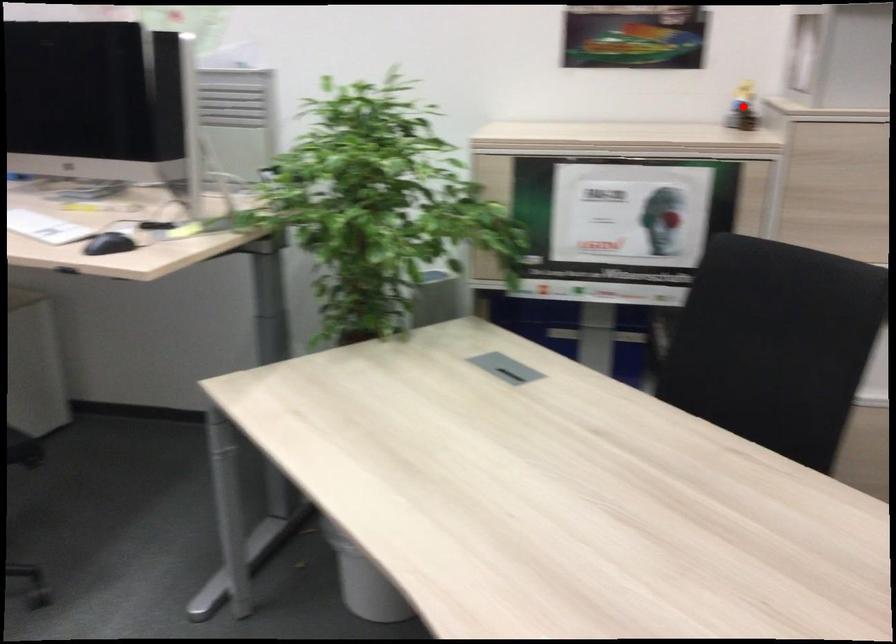
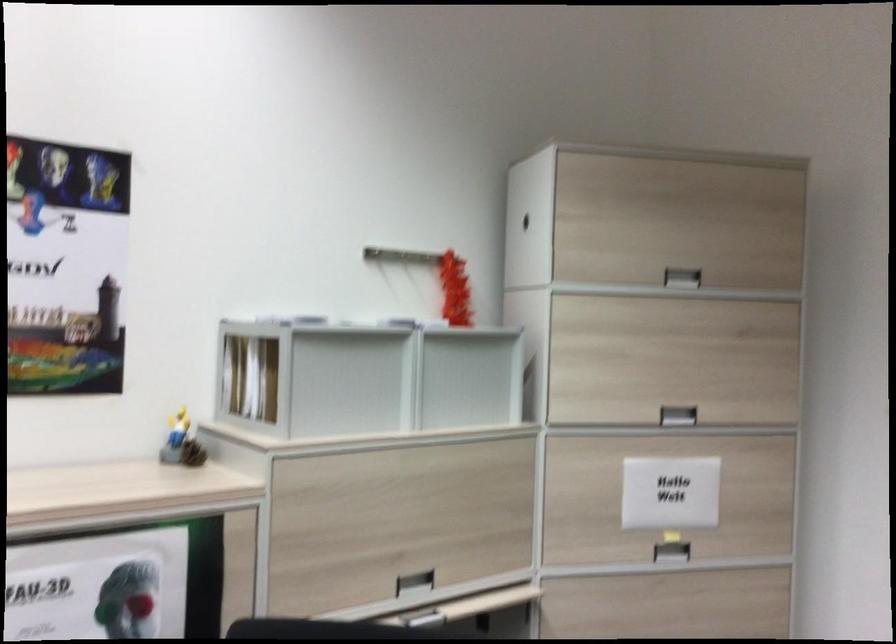
Question: I am providing you with two images of the same scene from different viewpoints. Image1 has a red point marked. In image2, the corresponding 3D location appears at what relative position? Reply with the corresponding letter.

Choices:
 (A) Closer
 (B) Farther

Answer: (A)